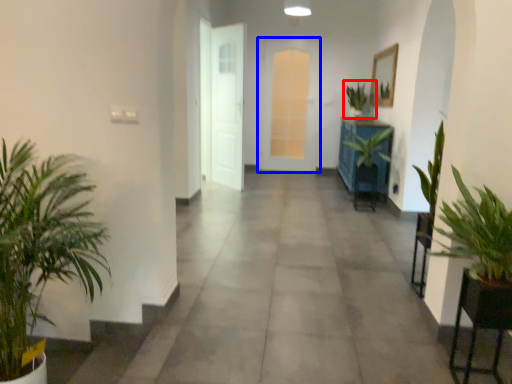
Question: Which of the following is the closest to the observer, houseplant (highlighted by a red box) or door (highlighted by a blue box)?

Choices:
 (A) houseplant
 (B) door

Answer: (A)